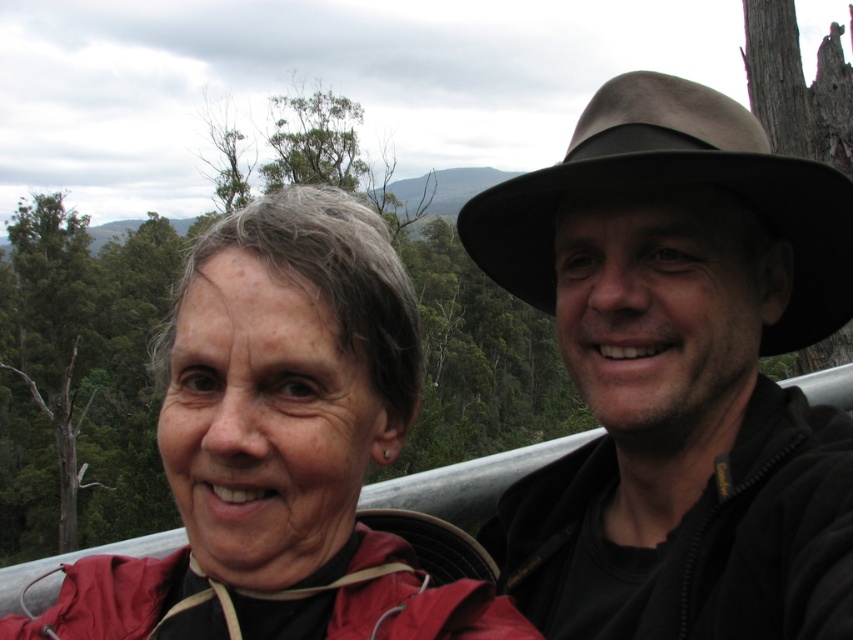
Does matte red jacket at left appear on the left side of brown felt cowboy hat at upper right?

Indeed, matte red jacket at left is positioned on the left side of brown felt cowboy hat at upper right.

Does matte red jacket at left have a greater width compared to brown felt cowboy hat at upper right?

No.

The image size is (853, 640). What are the coordinates of `matte red jacket at left` in the screenshot? It's located at (281, 448).

Find the location of `matte red jacket at left`. matte red jacket at left is located at coordinates (281, 448).